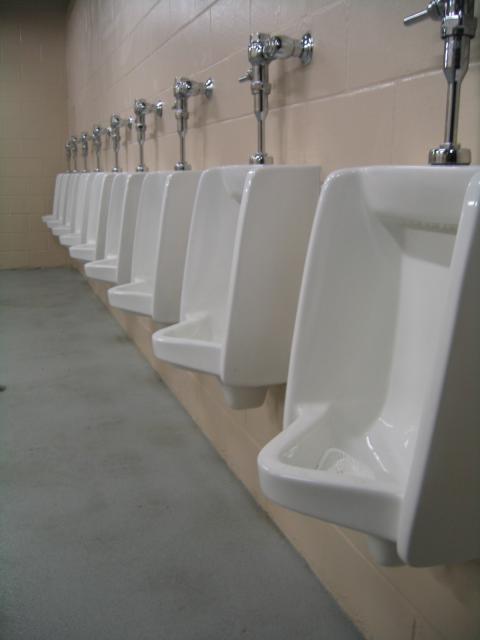
Find the location of `urinals`. urinals is located at coordinates (53, 203), (61, 193), (70, 200), (80, 205), (102, 212), (115, 219), (151, 227), (218, 251), (372, 326).